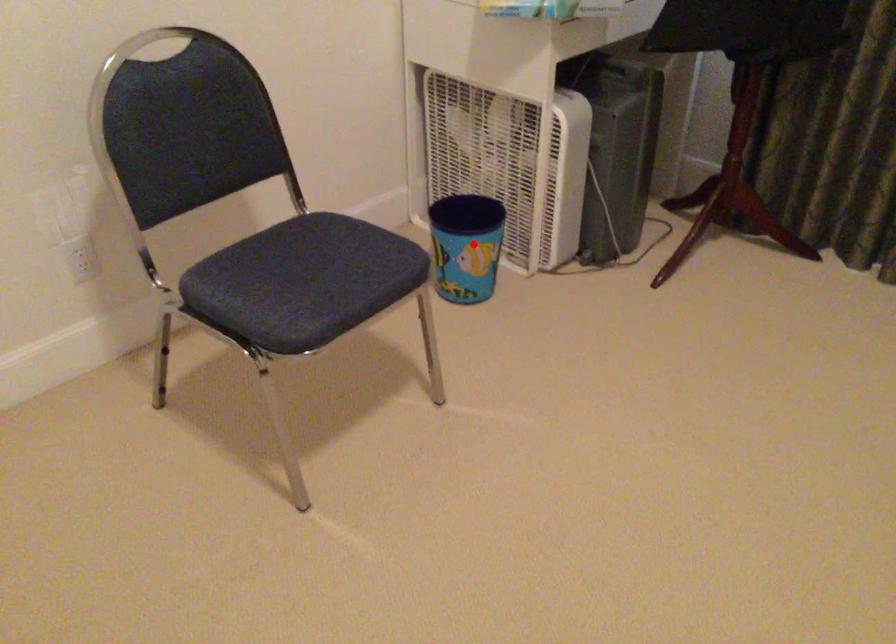
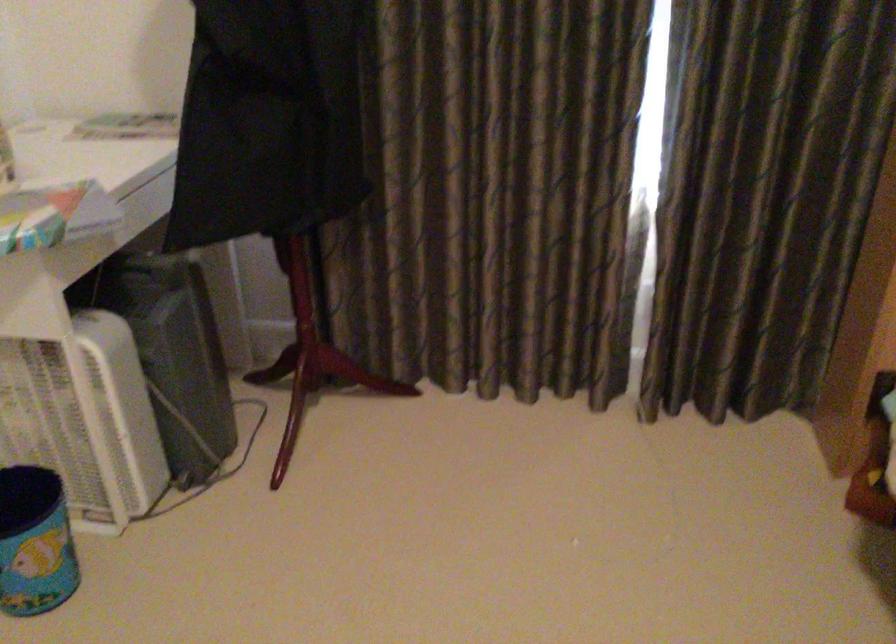
Locate, in the second image, the point that corresponds to the highlighted location in the first image.

(35, 542)